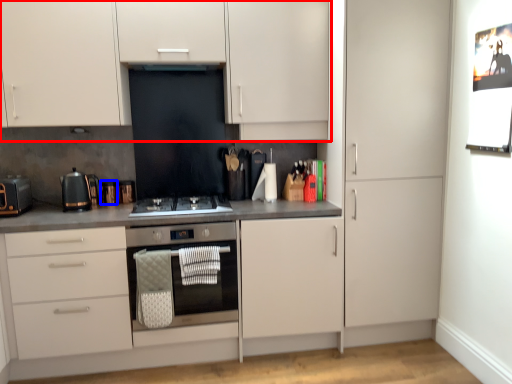
Question: Which object is further to the camera taking this photo, cabinetry (highlighted by a red box) or appliance (highlighted by a blue box)?

Choices:
 (A) cabinetry
 (B) appliance

Answer: (B)